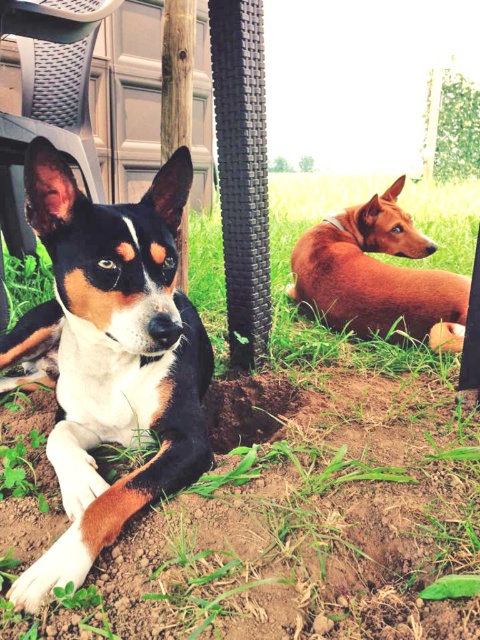
Who is more distant from viewer, (414, 492) or (105, 490)?

The point (414, 492) is behind.

Which is more to the left, green grass at center or white fur dog at center?

From the viewer's perspective, white fur dog at center appears more on the left side.

Between point (443, 216) and point (167, 477), which one is positioned behind?

The point (443, 216) is more distant.

The width and height of the screenshot is (480, 640). I want to click on green grass at center, so click(307, 497).

Which of these two, green grass at center or brown smooth dog at lower right, stands shorter?

With less height is green grass at center.

Looking at this image, is green grass at center positioned behind brown smooth dog at lower right?

No, it is not.

Locate an element on the screen. The width and height of the screenshot is (480, 640). green grass at center is located at coordinates (307, 497).

Identify the location of green grass at center. The width and height of the screenshot is (480, 640). (307, 497).

Is green grass at center to the right of dirt at center from the viewer's perspective?

Correct, you'll find green grass at center to the right of dirt at center.

Does green grass at center have a smaller size compared to dirt at center?

Actually, green grass at center might be larger than dirt at center.

The image size is (480, 640). What are the coordinates of `green grass at center` in the screenshot? It's located at (307, 497).